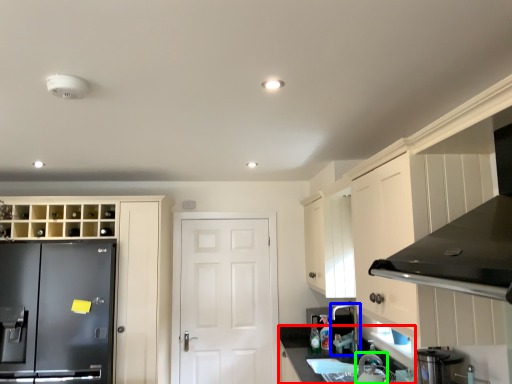
Question: Which object is the closest to the counter top (highlighted by a red box)? Choose among these: faucet (highlighted by a blue box) or appliance (highlighted by a green box).

Choices:
 (A) faucet
 (B) appliance

Answer: (A)